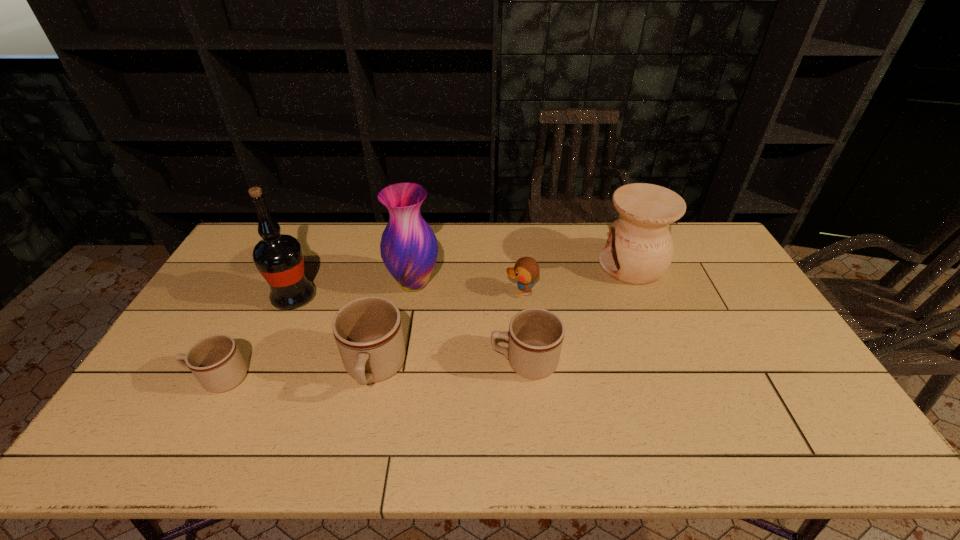
The width and height of the screenshot is (960, 540). I want to click on vacant space that is in between the pottery and the second shortest mug, so click(578, 313).

The height and width of the screenshot is (540, 960). What are the coordinates of `vacant space that is in between the duck and the vase` in the screenshot? It's located at (468, 287).

Where is `vacant space that is in between the duck and the pottery`? vacant space that is in between the duck and the pottery is located at coordinates (577, 278).

You are a GUI agent. You are given a task and a screenshot of the screen. Output one action in this format:
    pyautogui.click(x=<x>, y=<y>)
    Task: Click on the free space between the wine bottle and the vase
    The height and width of the screenshot is (540, 960).
    Given the screenshot: What is the action you would take?
    pyautogui.click(x=354, y=291)

The width and height of the screenshot is (960, 540). I want to click on unoccupied area between the wine bottle and the rightmost mug, so click(409, 330).

At what (x,y) coordinates should I click in order to perform the action: click on blank region between the rightmost object and the duck. Please return your answer as a coordinate pair (x, y). The height and width of the screenshot is (540, 960). Looking at the image, I should click on (577, 278).

Image resolution: width=960 pixels, height=540 pixels. In order to click on object that is the fourth closest to the wine bottle in this screenshot , I will do `click(535, 337)`.

Find the location of a particular element. This screenshot has height=540, width=960. the second closest object to the rightmost mug is located at coordinates (368, 332).

Select which mug appears as the second closest to the third tallest object. Please provide its 2D coordinates. Your answer should be formatted as a tuple, i.e. [(x, y)], where the tuple contains the x and y coordinates of a point satisfying the conditions above.

[(368, 332)]

Find the location of a particular element. The width and height of the screenshot is (960, 540). mug object that ranks as the second closest to the fourth shortest object is located at coordinates (216, 362).